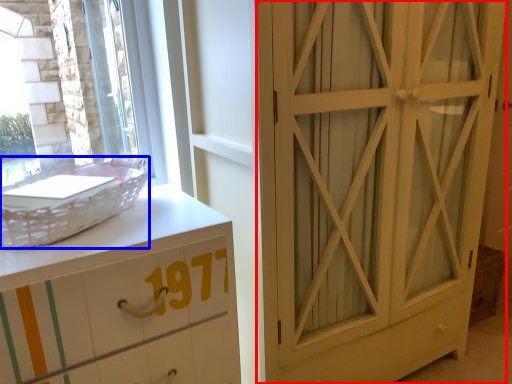
Question: Which of the following is the farthest to the observer, door (highlighted by a red box) or basket (highlighted by a blue box)?

Choices:
 (A) door
 (B) basket

Answer: (A)